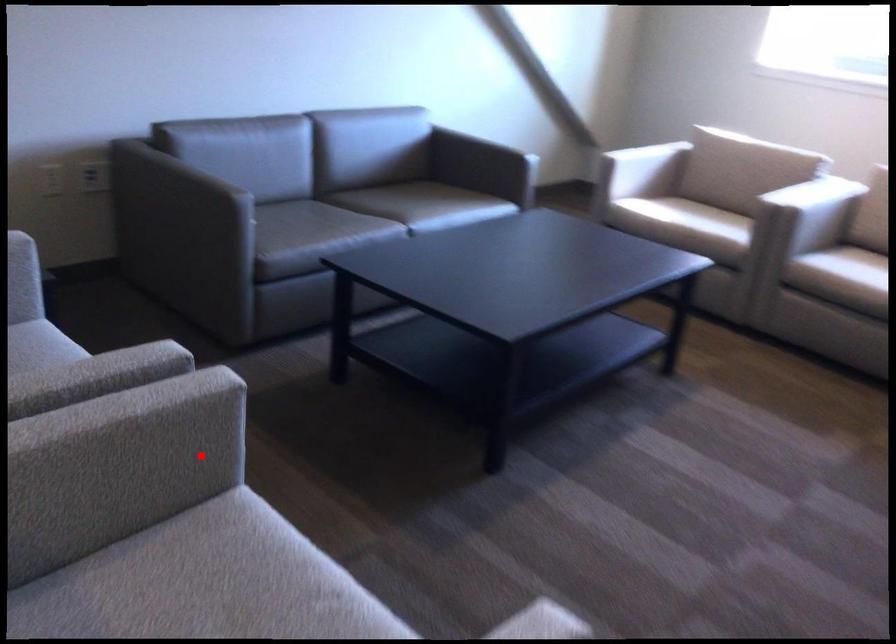
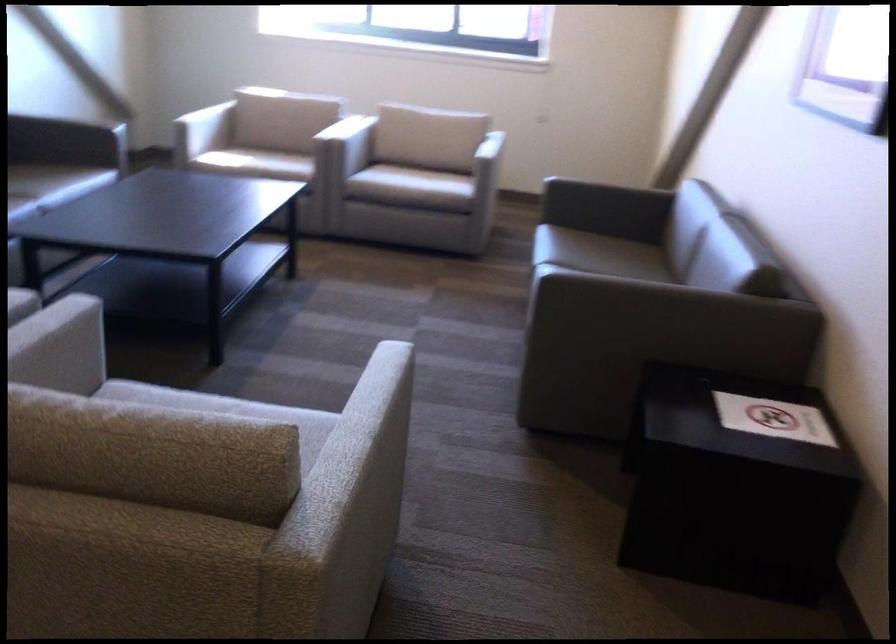
Locate, in the second image, the point that corresponds to the highlighted location in the first image.

(58, 368)